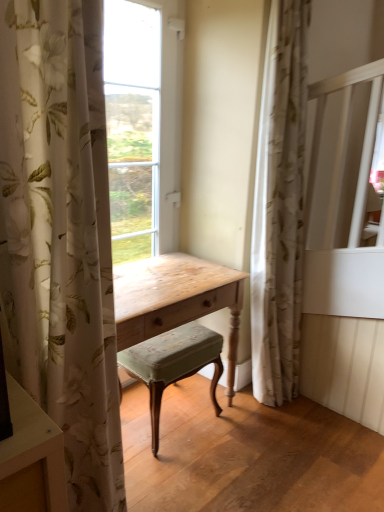
You are a GUI agent. You are given a task and a screenshot of the screen. Output one action in this format:
    pyautogui.click(x=<x>, y=<y>)
    Task: Click on the free space in front of velvet green cushioned stool at center
    This screenshot has height=512, width=384.
    Given the screenshot: What is the action you would take?
    pyautogui.click(x=188, y=471)